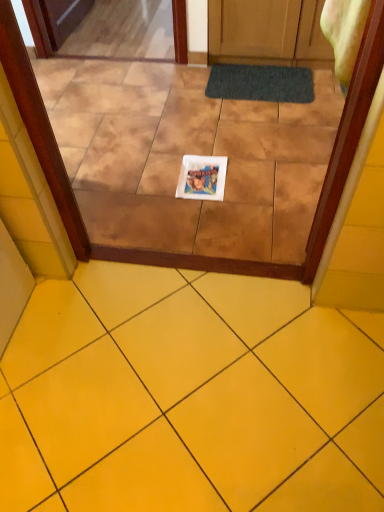
Image resolution: width=384 pixels, height=512 pixels. What are the coordinates of `vacant space underneath white paper at center (from a real-world perspective)` in the screenshot? It's located at (198, 178).